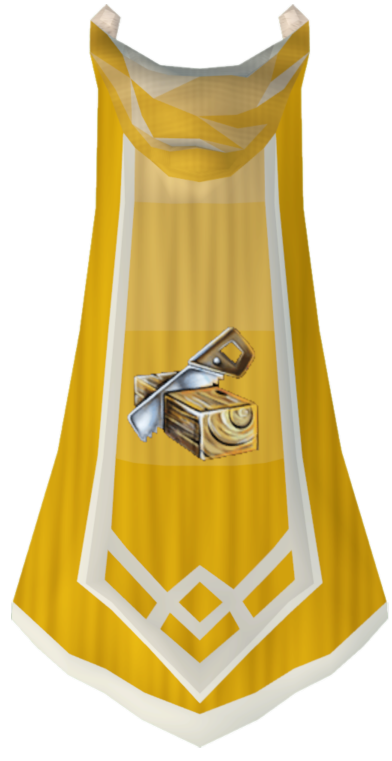
This screenshot has height=761, width=392. Find the location of `tapestry`. tapestry is located at coordinates (182, 128).